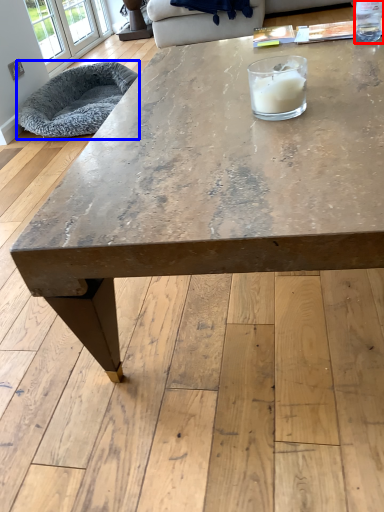
Question: Which point is closer to the camera, beverage (highlighted by a red box) or armchair (highlighted by a blue box)?

Choices:
 (A) beverage
 (B) armchair

Answer: (A)